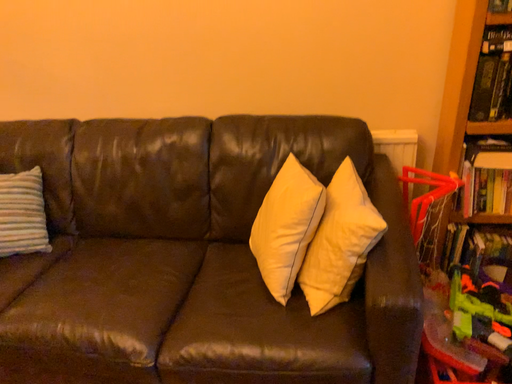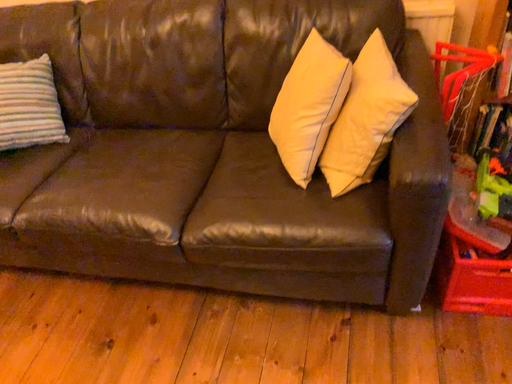
Question: Which way did the camera rotate in the video?

Choices:
 (A) rotated upward
 (B) rotated downward

Answer: (B)